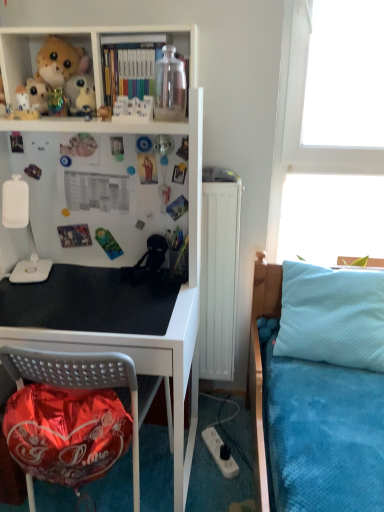
Question: Is transparent glass jar at upper center at the back of matte plastic books at upper center?

Choices:
 (A) yes
 (B) no

Answer: (B)

Question: Does matte plastic books at upper center appear on the right side of transparent glass jar at upper center?

Choices:
 (A) yes
 (B) no

Answer: (B)

Question: Is matte plastic books at upper center taller than transparent glass jar at upper center?

Choices:
 (A) no
 (B) yes

Answer: (A)

Question: Is matte plastic books at upper center positioned far away from transparent glass jar at upper center?

Choices:
 (A) yes
 (B) no

Answer: (B)

Question: From a real-world perspective, does matte plastic books at upper center sit lower than transparent glass jar at upper center?

Choices:
 (A) yes
 (B) no

Answer: (B)

Question: In the image, is transparent glass jar at upper center positioned in front of or behind light blue quilted pillow at right?

Choices:
 (A) behind
 (B) front

Answer: (B)

Question: Looking at their shapes, would you say transparent glass jar at upper center is wider or thinner than light blue quilted pillow at right?

Choices:
 (A) thin
 (B) wide

Answer: (A)

Question: Considering the positions of point (168, 117) and point (322, 340), is point (168, 117) closer or farther from the camera than point (322, 340)?

Choices:
 (A) closer
 (B) farther

Answer: (A)

Question: In terms of size, does transparent glass jar at upper center appear bigger or smaller than light blue quilted pillow at right?

Choices:
 (A) big
 (B) small

Answer: (B)

Question: Considering the positions of white plush toy at upper left, which ranks as the third toy in front-to-back order, and black matte desk at center in the image, is white plush toy at upper left, which ranks as the third toy in front-to-back order, taller or shorter than black matte desk at center?

Choices:
 (A) tall
 (B) short

Answer: (B)

Question: Considering the positions of white plush toy at upper left, which ranks as the third toy in front-to-back order, and black matte desk at center in the image, is white plush toy at upper left, which ranks as the third toy in front-to-back order, wider or thinner than black matte desk at center?

Choices:
 (A) thin
 (B) wide

Answer: (A)

Question: In the image, is white plush toy at upper left, which ranks as the third toy in front-to-back order, positioned in front of or behind black matte desk at center?

Choices:
 (A) front
 (B) behind

Answer: (B)

Question: Based on their positions, is white plush toy at upper left, which appears as the 3th toy when viewed from the right, located to the left or right of black matte desk at center?

Choices:
 (A) left
 (B) right

Answer: (A)

Question: Looking at their shapes, would you say white plastic lamp at left is wider or thinner than light blue quilted pillow at right?

Choices:
 (A) thin
 (B) wide

Answer: (A)

Question: Is white plastic lamp at left in front of or behind light blue quilted pillow at right in the image?

Choices:
 (A) behind
 (B) front

Answer: (B)